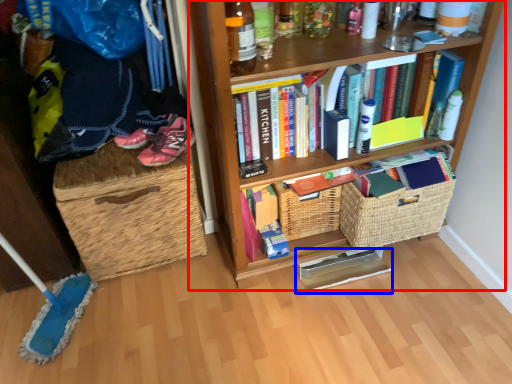
Question: Which object appears closest to the camera in this image, bookcase (highlighted by a red box) or book (highlighted by a blue box)?

Choices:
 (A) bookcase
 (B) book

Answer: (A)